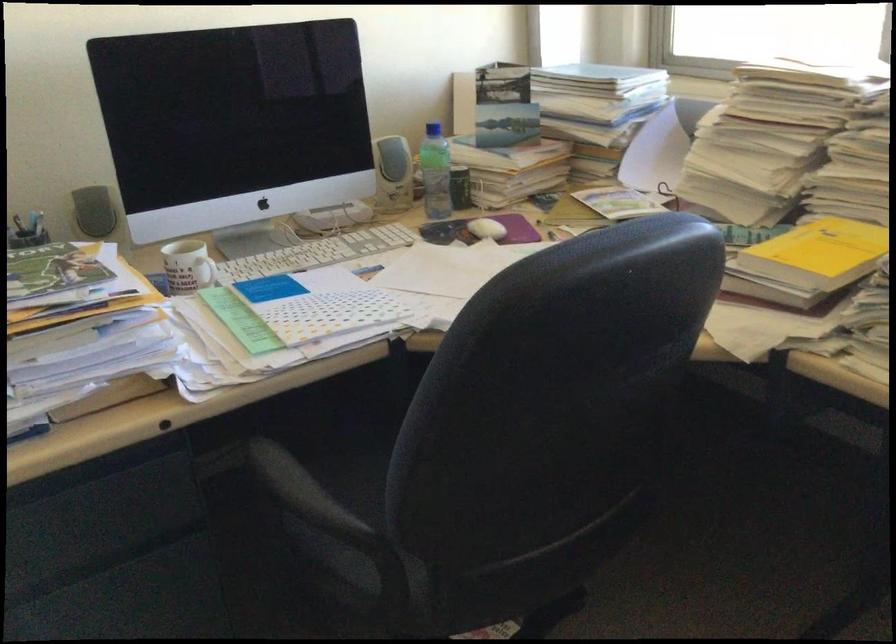
What do you see at coordinates (314, 521) in the screenshot? I see `the black chair armrest` at bounding box center [314, 521].